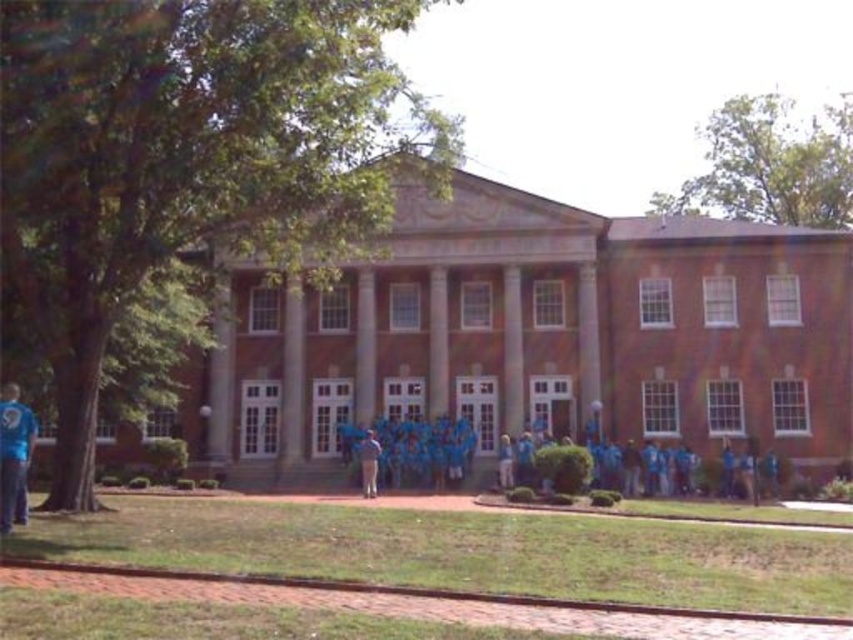
Question: Which object is positioned farthest from the smooth stone column at center?

Choices:
 (A) blue fabric shirt at center
 (B) blue fabric shirt at left

Answer: (B)

Question: Can you confirm if smooth stone column at center is positioned above smooth stone pillar at center?

Choices:
 (A) no
 (B) yes

Answer: (A)

Question: Based on their relative distances, which object is nearer to the blue fabric shirt at left?

Choices:
 (A) smooth stone column at center
 (B) green grass at lower center

Answer: (B)

Question: Does smooth stone column at center appear over blue fabric shirt at left?

Choices:
 (A) no
 (B) yes

Answer: (B)

Question: Is green grass at lower center in front of smooth stone column at center?

Choices:
 (A) yes
 (B) no

Answer: (A)

Question: Which object is closer to the camera taking this photo?

Choices:
 (A) smooth stone pillar at center
 (B) green grass at lower center

Answer: (B)